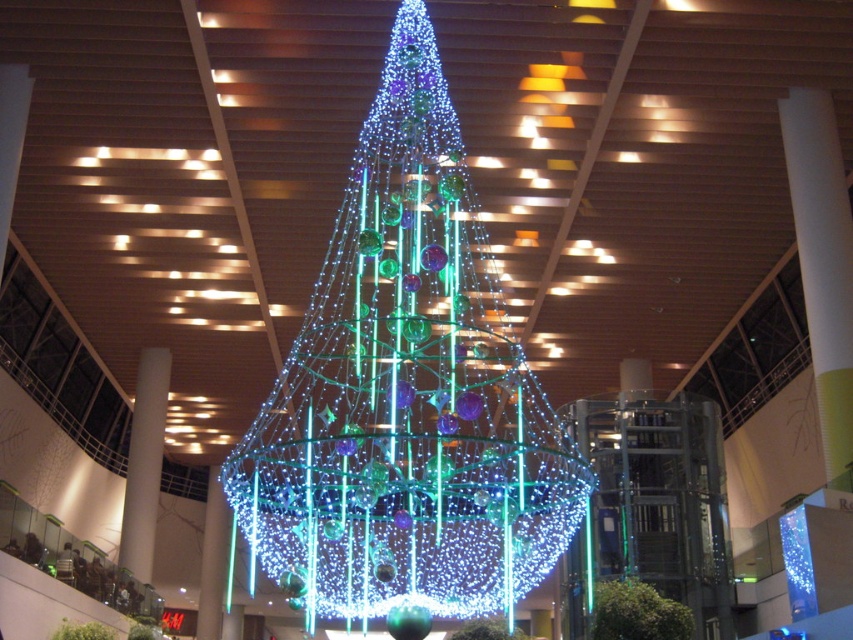
Question: Can you confirm if illuminated glass christmas tree at center is positioned below iridescent glass ornaments at center?

Choices:
 (A) no
 (B) yes

Answer: (A)

Question: Which of the following is the closest to the observer?

Choices:
 (A) iridescent glass ornaments at center
 (B) illuminated glass christmas tree at center

Answer: (B)

Question: In this image, where is illuminated glass christmas tree at center located relative to iridescent glass ornaments at center?

Choices:
 (A) right
 (B) left

Answer: (B)

Question: Which of the following is the closest to the observer?

Choices:
 (A) (631, 616)
 (B) (360, 369)

Answer: (B)

Question: Is illuminated glass christmas tree at center positioned behind iridescent glass ornaments at center?

Choices:
 (A) yes
 (B) no

Answer: (B)

Question: Which object appears closest to the camera in this image?

Choices:
 (A) illuminated glass christmas tree at center
 (B) iridescent glass ornaments at center

Answer: (A)